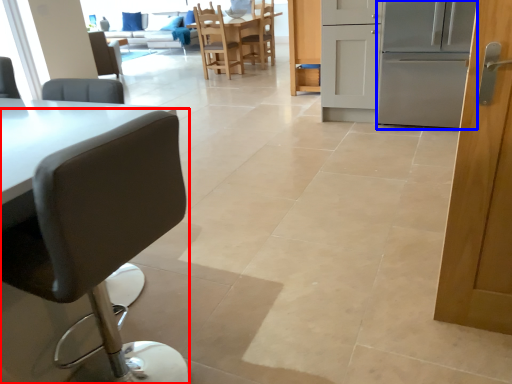
Question: Which object appears farthest to the camera in this image, chair (highlighted by a red box) or oven (highlighted by a blue box)?

Choices:
 (A) chair
 (B) oven

Answer: (B)